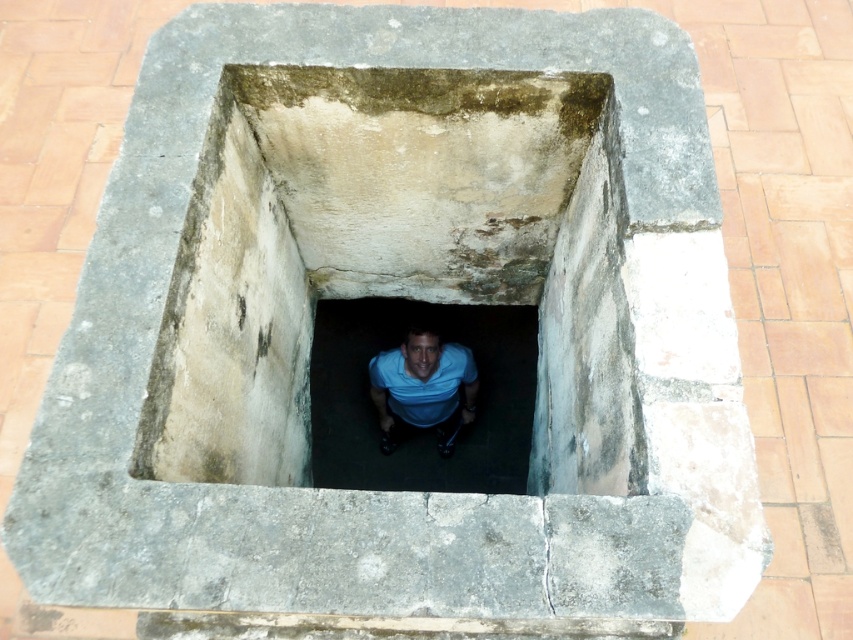
Question: Does concrete well at center appear on the left side of blue fabric man at center?

Choices:
 (A) no
 (B) yes

Answer: (A)

Question: Which point is closer to the camera?

Choices:
 (A) blue matte shirt at center
 (B) concrete well at center

Answer: (B)

Question: Based on their relative distances, which object is farther from the blue fabric man at center?

Choices:
 (A) concrete well at center
 (B) blue matte shirt at center

Answer: (A)

Question: Is concrete well at center positioned before blue fabric man at center?

Choices:
 (A) no
 (B) yes

Answer: (B)

Question: Where is concrete well at center located in relation to blue fabric man at center in the image?

Choices:
 (A) below
 (B) above

Answer: (B)

Question: Among these objects, which one is nearest to the camera?

Choices:
 (A) concrete well at center
 (B) blue matte shirt at center

Answer: (A)